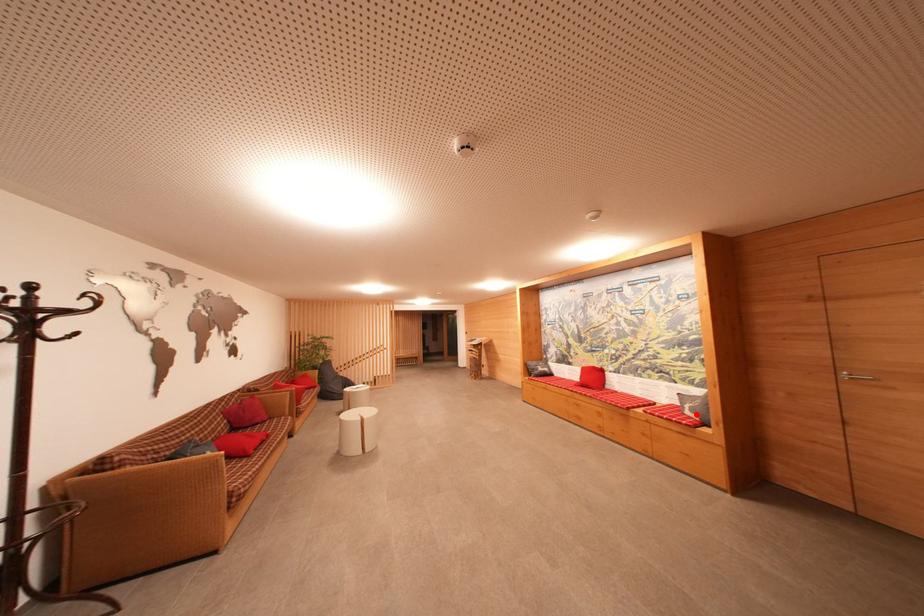
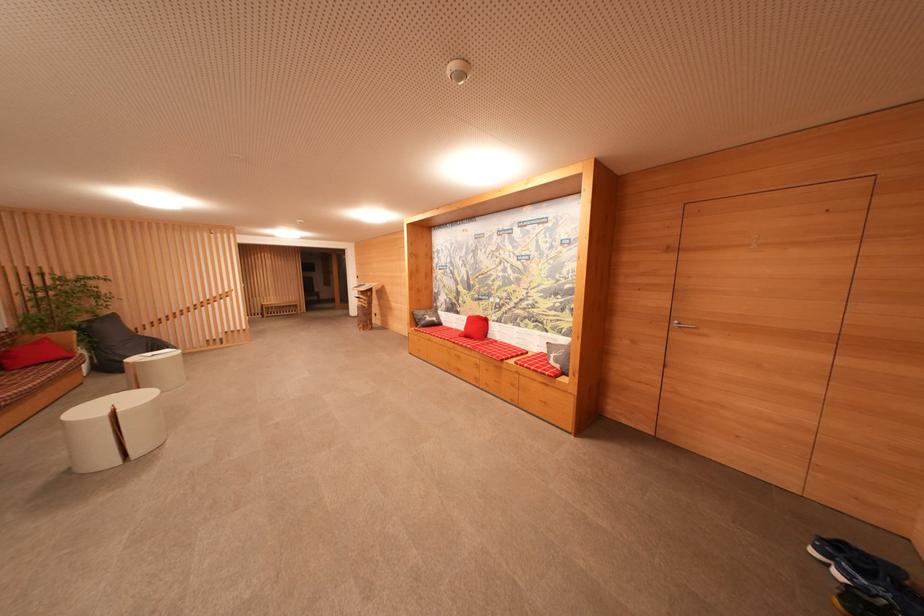
The point at the highlighted location is marked in the first image. Where is the corresponding point in the second image?

(560, 363)